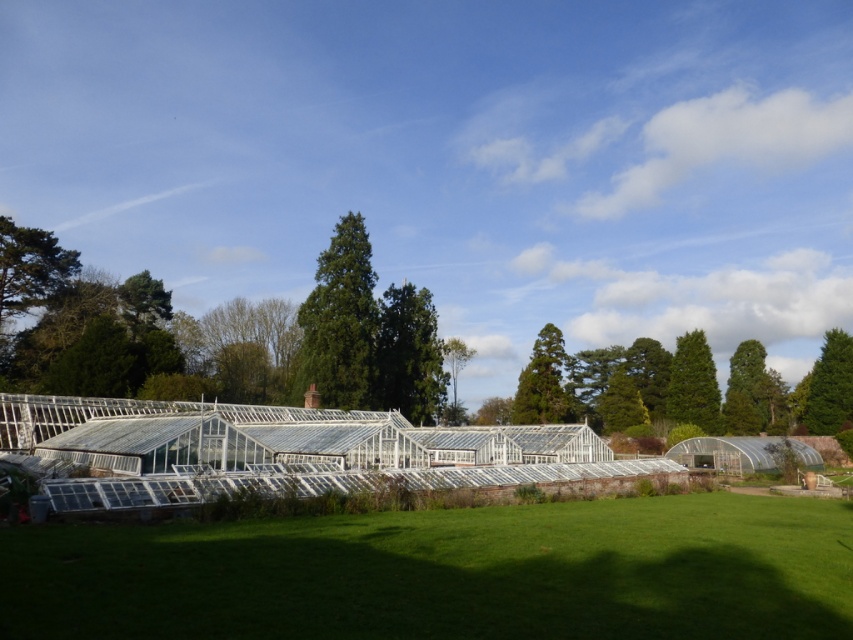
Does green matte tree at right come in front of green leafy tree at center?

No, green matte tree at right is behind green leafy tree at center.

Can you confirm if green matte tree at right is bigger than green leafy tree at center?

No.

Is point (827, 404) closer to camera compared to point (460, 369)?

Yes.

Where is `green matte tree at right`? This screenshot has width=853, height=640. green matte tree at right is located at coordinates (830, 385).

The width and height of the screenshot is (853, 640). Describe the element at coordinates (340, 321) in the screenshot. I see `green matte tree at center` at that location.

Between point (351, 317) and point (532, 348), which one is positioned behind?

The point (532, 348) is more distant.

Does point (352, 381) come in front of point (515, 420)?

Yes.

The height and width of the screenshot is (640, 853). Find the location of `green matte tree at center`. green matte tree at center is located at coordinates (340, 321).

How much distance is there between transparent glass greenhouse at lower center and green leafy tree at upper right?

transparent glass greenhouse at lower center is 73.97 meters away from green leafy tree at upper right.

Can you confirm if transparent glass greenhouse at lower center is positioned above green leafy tree at upper right?

Indeed, transparent glass greenhouse at lower center is positioned over green leafy tree at upper right.

What do you see at coordinates (445, 572) in the screenshot? The width and height of the screenshot is (853, 640). I see `transparent glass greenhouse at lower center` at bounding box center [445, 572].

Find the location of `transparent glass greenhouse at lower center`. transparent glass greenhouse at lower center is located at coordinates (445, 572).